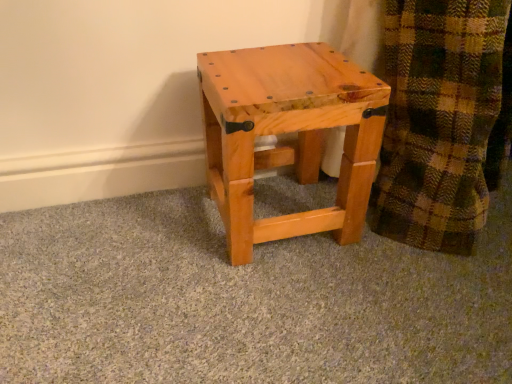
Locate an element on the screen. The width and height of the screenshot is (512, 384). free space in front of natural wood stool at center is located at coordinates (285, 299).